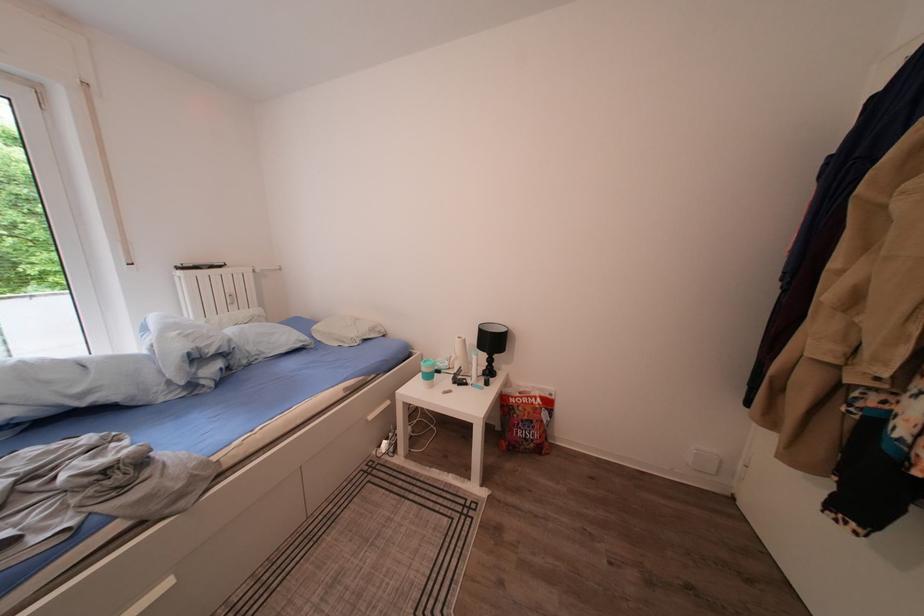
Image resolution: width=924 pixels, height=616 pixels. Describe the element at coordinates (233, 298) in the screenshot. I see `a radiator control knob` at that location.